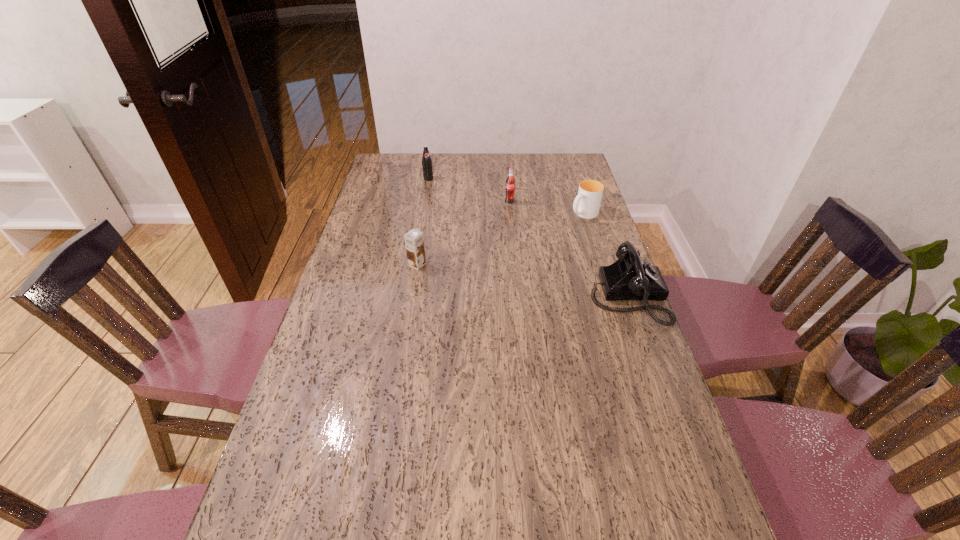
The width and height of the screenshot is (960, 540). Find the location of `free space located on the label of the nearer pop`. free space located on the label of the nearer pop is located at coordinates (517, 221).

The height and width of the screenshot is (540, 960). In order to click on vacant space positioned on the label of the nearer pop in this screenshot , I will do (535, 260).

The width and height of the screenshot is (960, 540). I want to click on vacant space situated on the front label of the farther pop, so click(x=441, y=198).

You are a GUI agent. You are given a task and a screenshot of the screen. Output one action in this format:
    pyautogui.click(x=<x>, y=<y>)
    Task: Click on the free space located 0.290m on the front label of the farther pop
    
    Given the screenshot: What is the action you would take?
    pyautogui.click(x=454, y=218)

This screenshot has height=540, width=960. I want to click on vacant point located on the front label of the farther pop, so click(x=442, y=199).

The width and height of the screenshot is (960, 540). In order to click on vacant space located with the handle on the side of the shortest object in this screenshot , I will do `click(536, 245)`.

Find the location of `vacant space situated with the handle on the side of the shortest object`. vacant space situated with the handle on the side of the shortest object is located at coordinates (556, 232).

This screenshot has height=540, width=960. In order to click on free region located with the handle on the side of the shortest object in this screenshot , I will do [x=526, y=251].

Where is `object situated at the far edge`? object situated at the far edge is located at coordinates (427, 167).

This screenshot has width=960, height=540. Identify the location of telephone located in the right edge section of the desktop. (629, 278).